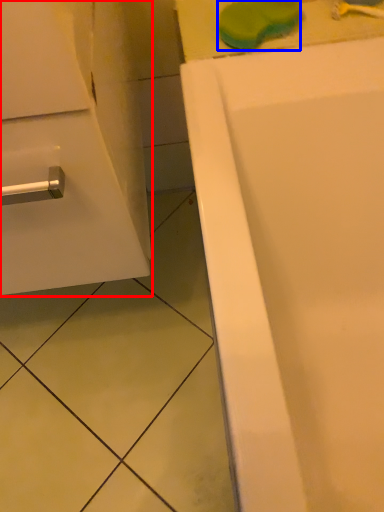
Question: Which object is closer to the camera taking this photo, bathroom cabinet (highlighted by a red box) or soap (highlighted by a blue box)?

Choices:
 (A) bathroom cabinet
 (B) soap

Answer: (A)